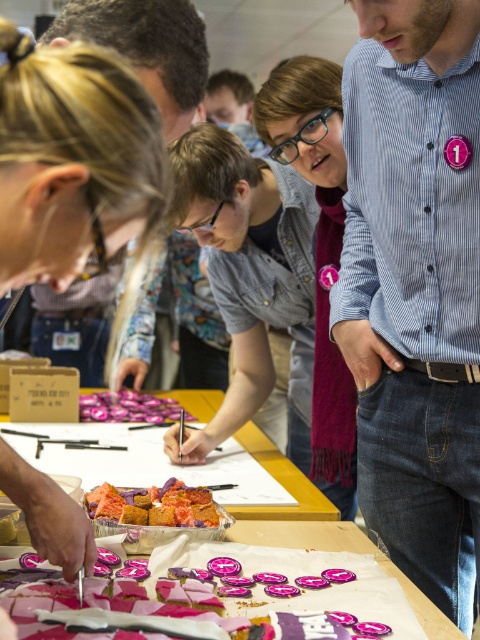
Question: Which point appears farthest from the camera in this image?

Choices:
 (A) (34, 292)
 (B) (132, 403)
 (C) (396, 262)
 (D) (412, 602)

Answer: (A)

Question: Does purple scarf at center appear over crumbly pink cake at center?

Choices:
 (A) no
 (B) yes

Answer: (B)

Question: Is matte black hair at lower left in front of purple scarf at center?

Choices:
 (A) yes
 (B) no

Answer: (A)

Question: Can you confirm if blue striped shirt at center is bigger than matte black hair at lower left?

Choices:
 (A) yes
 (B) no

Answer: (A)

Question: Which point appears closest to the camera in this image?

Choices:
 (A) (191, 32)
 (B) (152, 410)
 (C) (11, 24)

Answer: (C)

Question: Which of these objects is positioned farthest from the purple scarf at center?

Choices:
 (A) blue striped shirt at center
 (B) matte black hair at lower left

Answer: (B)